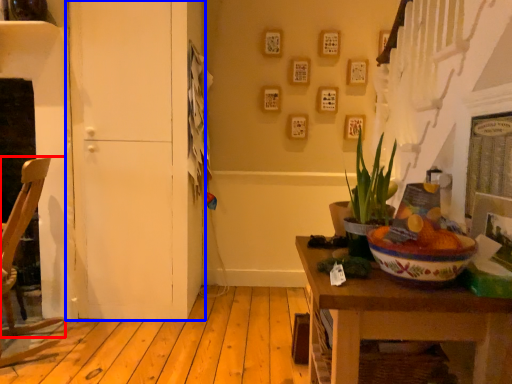
Question: Which object is closer to the camera taking this photo, chair (highlighted by a red box) or door (highlighted by a blue box)?

Choices:
 (A) chair
 (B) door

Answer: (A)